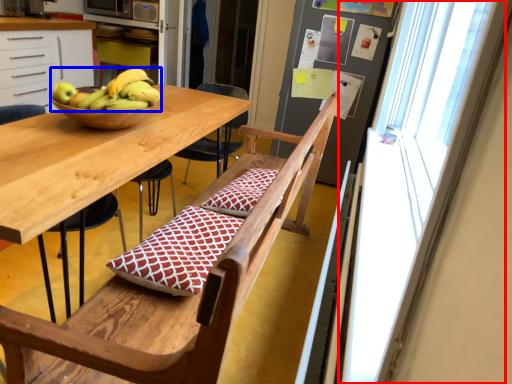
Question: Which of the following is the closest to the observer, window screen (highlighted by a red box) or banana (highlighted by a blue box)?

Choices:
 (A) window screen
 (B) banana

Answer: (A)